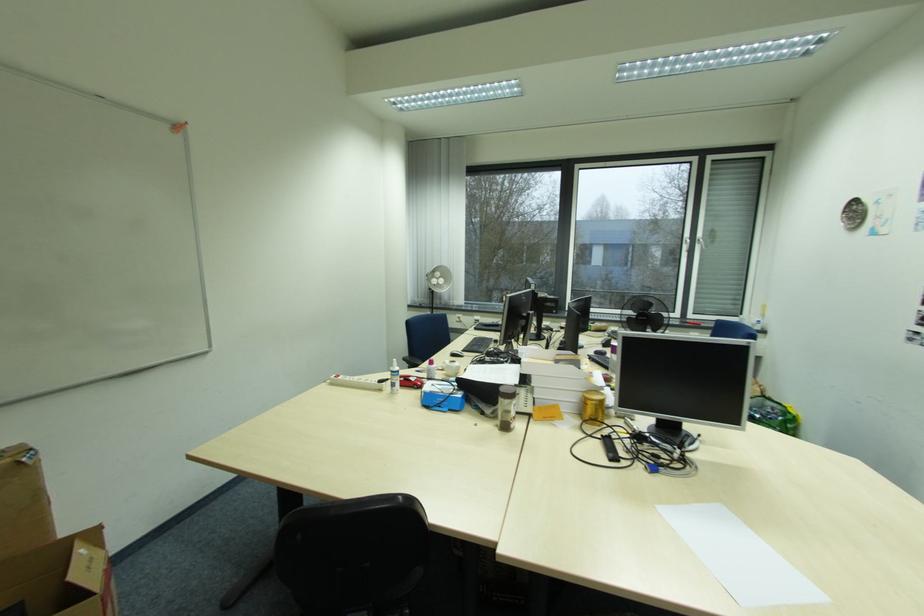
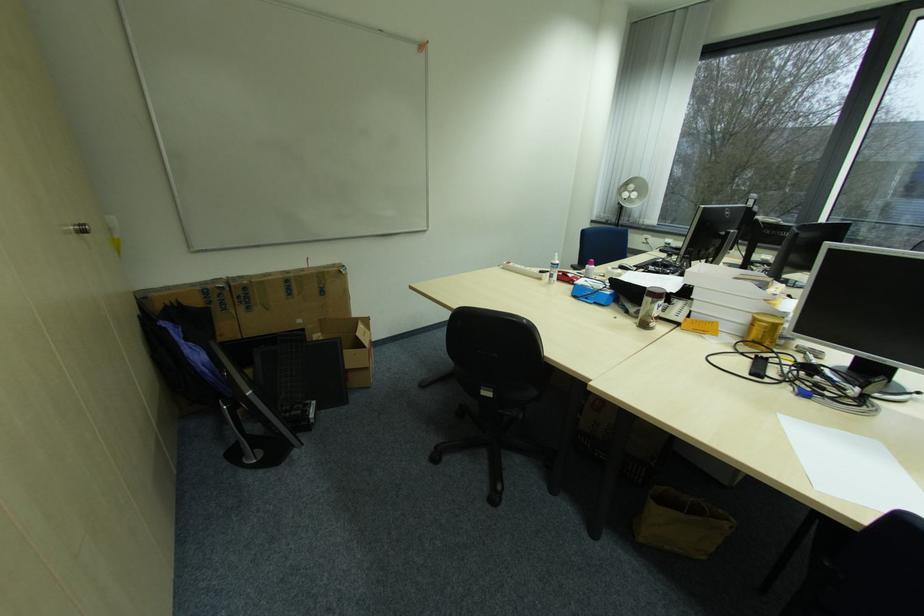
Locate, in the second image, the point that corresponds to the point at 435,377 in the first image.

(592, 276)